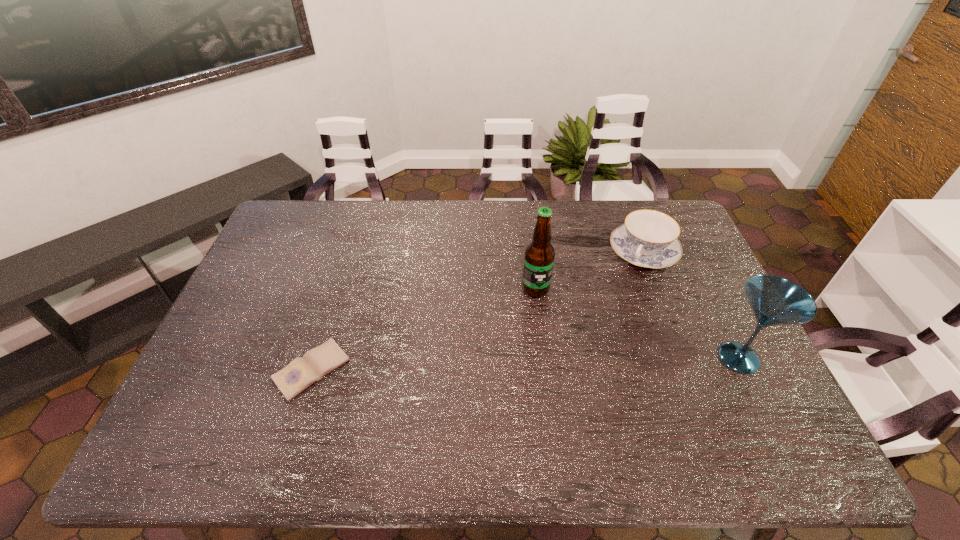
Locate an element on the screen. This screenshot has width=960, height=540. the leftmost object is located at coordinates (302, 372).

I want to click on the shortest object, so 302,372.

At what (x,y) coordinates should I click in order to perform the action: click on the third shortest object. Please return your answer as a coordinate pair (x, y). Looking at the image, I should click on (774, 300).

Find the location of a particular element. The height and width of the screenshot is (540, 960). the farthest object is located at coordinates pos(648,239).

Identify the location of the third tallest object. (648, 239).

The height and width of the screenshot is (540, 960). I want to click on the tallest object, so click(539, 255).

You are a GUI agent. You are given a task and a screenshot of the screen. Output one action in this format:
    pyautogui.click(x=<x>, y=<y>)
    Task: Click on the beer bottle
    
    Given the screenshot: What is the action you would take?
    point(539,255)

At what (x,y) coordinates should I click in order to perform the action: click on vacant space located on the right of the shortest object. Please return your answer as a coordinate pair (x, y). Looking at the image, I should click on (461, 369).

Where is `vacant space located 0.270m on the left of the martini`? Image resolution: width=960 pixels, height=540 pixels. vacant space located 0.270m on the left of the martini is located at coordinates (611, 358).

Find the location of `vacant point located 0.060m with the handle on the side of the chinaware`. vacant point located 0.060m with the handle on the side of the chinaware is located at coordinates (628, 284).